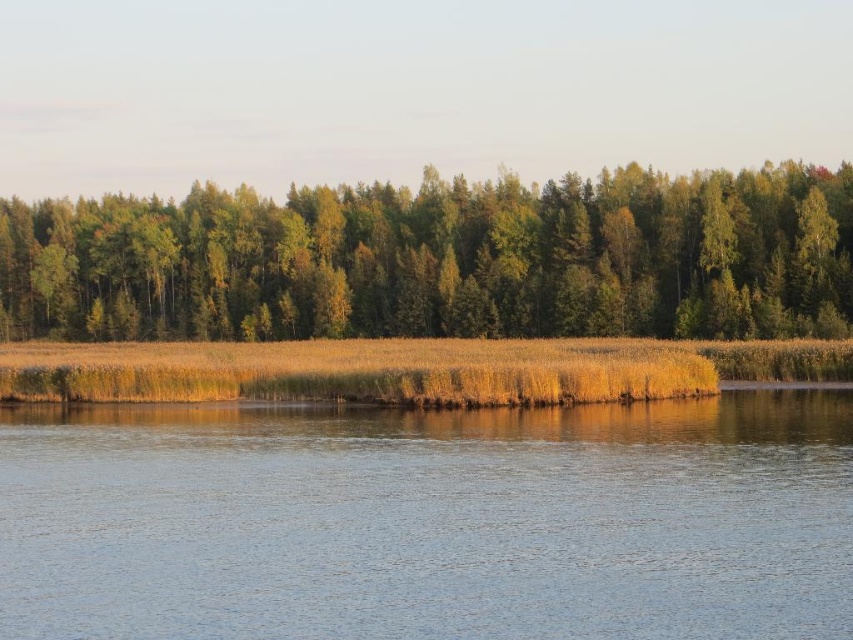
Question: Is blue water at center bigger than green leafy trees at center?

Choices:
 (A) no
 (B) yes

Answer: (A)

Question: Is blue water at center to the right of green leafy trees at center from the viewer's perspective?

Choices:
 (A) yes
 (B) no

Answer: (A)

Question: Which of the following is the farthest from the observer?

Choices:
 (A) blue water at center
 (B) green leafy trees at center

Answer: (B)

Question: Is blue water at center below green leafy trees at center?

Choices:
 (A) yes
 (B) no

Answer: (A)